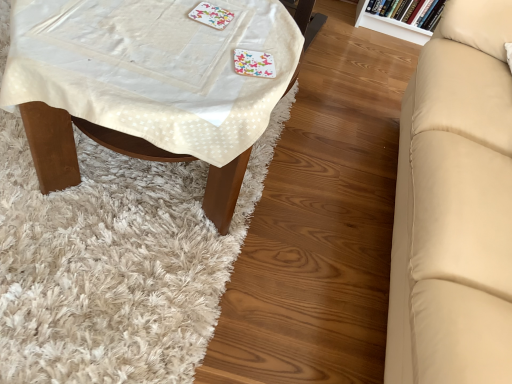
Question: Looking at the image, does white fabric-covered table at left seem bigger or smaller compared to beige leather couch at right?

Choices:
 (A) big
 (B) small

Answer: (B)

Question: Is white fabric-covered table at left in front of or behind beige leather couch at right in the image?

Choices:
 (A) front
 (B) behind

Answer: (B)

Question: Which of these objects is positioned closest to the colorful paper coaster at upper center?

Choices:
 (A) white glossy bookshelf at upper right
 (B) white textured mat at lower left
 (C) white fabric-covered table at left
 (D) beige leather couch at right

Answer: (C)

Question: Which object is positioned farthest from the white glossy bookshelf at upper right?

Choices:
 (A) beige leather couch at right
 (B) white fabric-covered table at left
 (C) white textured mat at lower left
 (D) colorful paper coaster at upper center

Answer: (B)